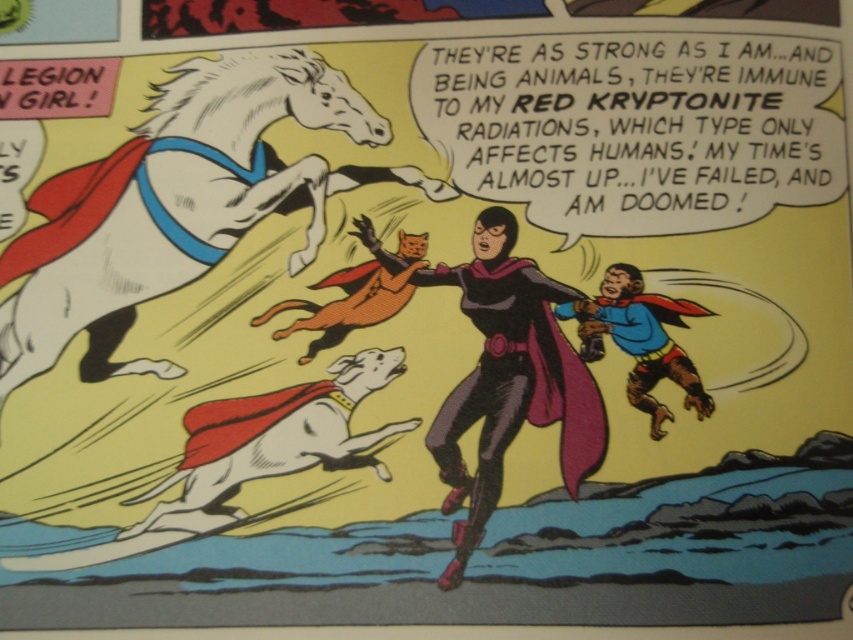
Based on the scene description, what object is located at the coordinates point (169,205)?

The point (169,205) indicates the white glossy horse at upper left.

You are an artist trying to draw this comic panel. You need to place two points on the image for reference. The first point is at coordinates point (x=241, y=220) and the second point is at point (x=488, y=380). Which point is closer to you?

Point (x=241, y=220) is closer to you because it is further to the viewer than point (x=488, y=380).

You are an artist trying to draw the comic book scene described. You want to ensure the proportions of the white glossy horse at upper left and the black glossy cape at center are accurate. Based on the scene, which object should be drawn larger?

The white glossy horse at upper left should be drawn larger because it is larger in size than the black glossy cape at center according to the description.